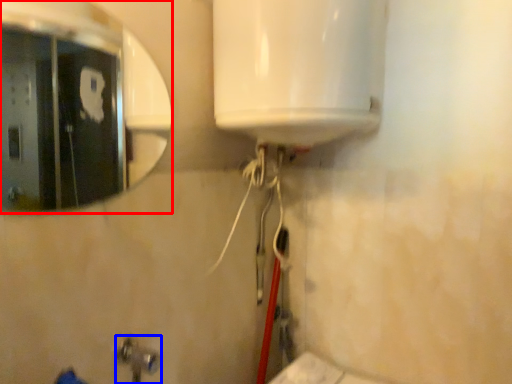
Question: Which object appears closest to the camera in this image, mirror (highlighted by a red box) or plumbing fixture (highlighted by a blue box)?

Choices:
 (A) mirror
 (B) plumbing fixture

Answer: (B)